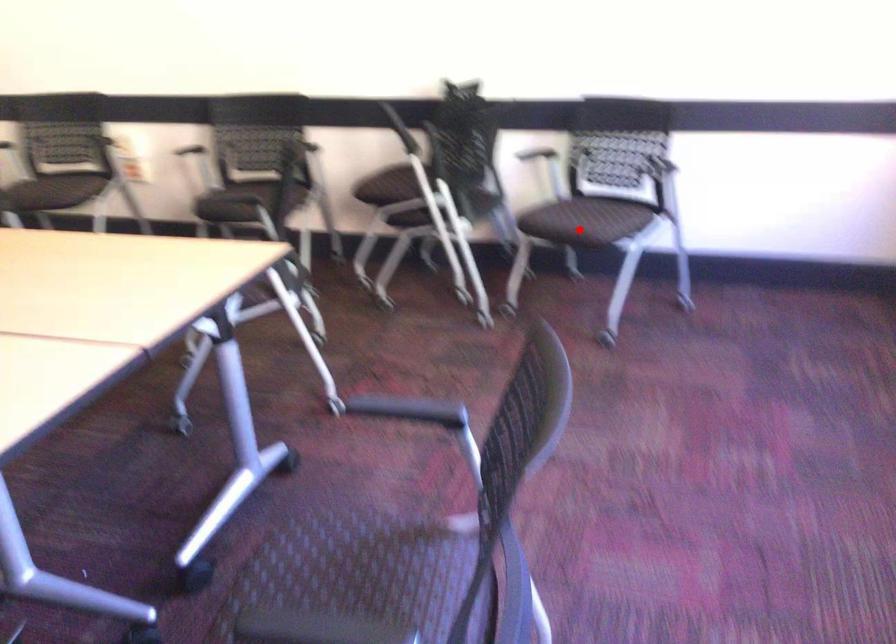
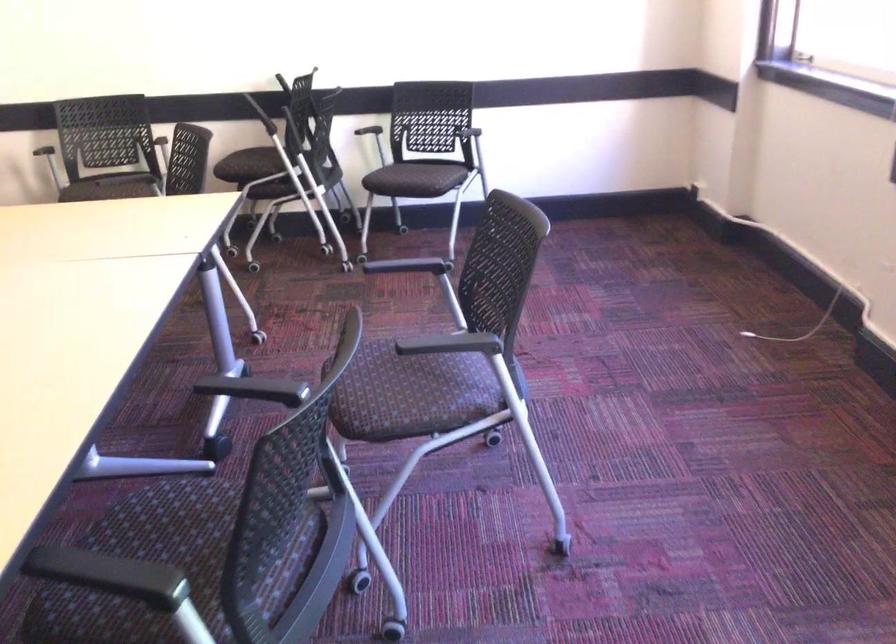
Question: I am providing you with two images of the same scene from different viewpoints. Image1 has a red point marked. In image2, the corresponding 3D location appears at what relative position? Reply with the corresponding letter.

Choices:
 (A) Closer
 (B) Farther

Answer: (B)